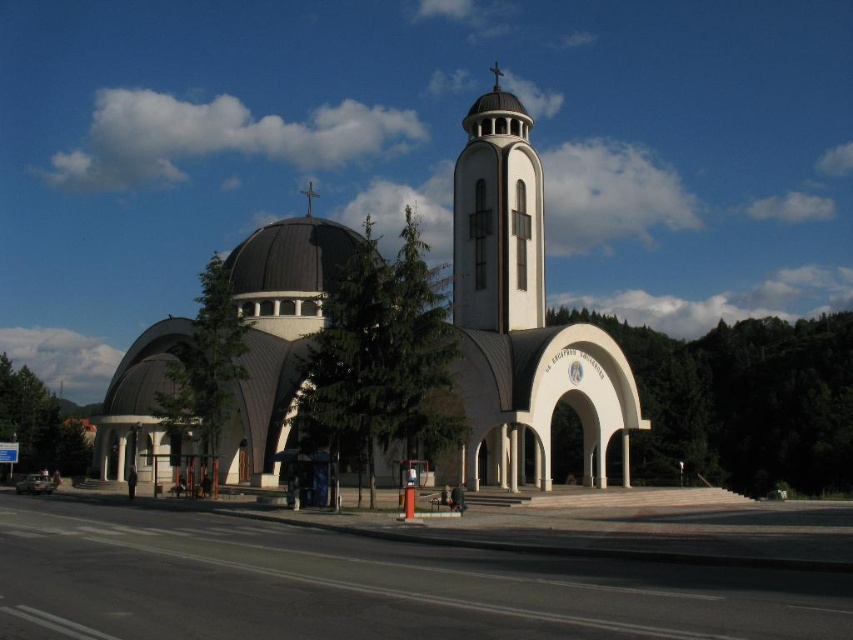
Who is positioned more to the right, white smooth church at center or white smooth tower at center?

Positioned to the right is white smooth tower at center.

Based on the photo, does white smooth church at center appear over white smooth tower at center?

Incorrect, white smooth church at center is not positioned above white smooth tower at center.

Who is more forward, (x=293, y=218) or (x=508, y=195)?

Point (x=508, y=195) is in front.

In order to click on white smooth church at center in this screenshot , I will do `click(520, 317)`.

Which is behind, point (497, 161) or point (310, 205)?

Positioned behind is point (310, 205).

Can you confirm if white smooth tower at center is taller than metallic cross at center?

Correct, white smooth tower at center is much taller as metallic cross at center.

Is point (498, 307) positioned in front of point (306, 189)?

Yes, point (498, 307) is closer to viewer.

Find the location of a particular element. This screenshot has width=853, height=640. white smooth tower at center is located at coordinates (497, 218).

The height and width of the screenshot is (640, 853). What do you see at coordinates (520, 317) in the screenshot?
I see `white smooth church at center` at bounding box center [520, 317].

The image size is (853, 640). What do you see at coordinates (520, 317) in the screenshot?
I see `white smooth church at center` at bounding box center [520, 317].

Locate an element on the screen. The height and width of the screenshot is (640, 853). white smooth church at center is located at coordinates (520, 317).